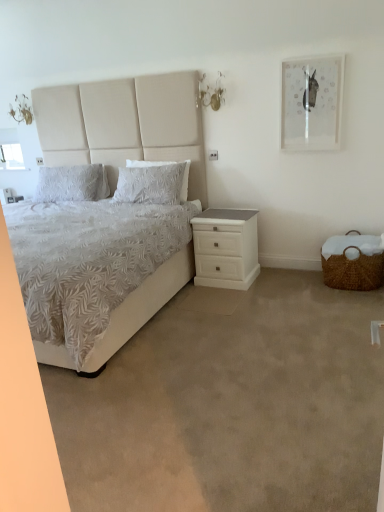
Question: Is white matte nightstand at lower right positioned behind white textured pillow at center, the second pillow when ordered from left to right?

Choices:
 (A) no
 (B) yes

Answer: (A)

Question: Does white matte nightstand at lower right have a lesser height compared to white textured pillow at center, placed as the first pillow when sorted from right to left?

Choices:
 (A) yes
 (B) no

Answer: (B)

Question: Does white matte nightstand at lower right have a smaller size compared to white textured pillow at center, placed as the first pillow when sorted from right to left?

Choices:
 (A) yes
 (B) no

Answer: (B)

Question: Is white textured pillow at center, the second pillow when ordered from left to right, a part of white matte nightstand at lower right?

Choices:
 (A) yes
 (B) no

Answer: (B)

Question: Is white textured pillow at center, placed as the first pillow when sorted from right to left, at the back of white matte nightstand at lower right?

Choices:
 (A) yes
 (B) no

Answer: (B)

Question: From the image's perspective, is white fabric bed at left above or below white textured pillow at center, placed as the first pillow when sorted from right to left?

Choices:
 (A) below
 (B) above

Answer: (A)

Question: Considering the positions of white fabric bed at left and white textured pillow at center, placed as the first pillow when sorted from right to left, in the image, is white fabric bed at left bigger or smaller than white textured pillow at center, placed as the first pillow when sorted from right to left,?

Choices:
 (A) big
 (B) small

Answer: (A)

Question: Is white fabric bed at left in front of or behind white textured pillow at center, the second pillow when ordered from left to right, in the image?

Choices:
 (A) front
 (B) behind

Answer: (A)

Question: Does point (205, 206) appear closer or farther from the camera than point (175, 185)?

Choices:
 (A) farther
 (B) closer

Answer: (A)

Question: Based on their sizes in the image, would you say white textured pillow at center, the second pillow when ordered from left to right, is bigger or smaller than beige carpet at lower center?

Choices:
 (A) big
 (B) small

Answer: (B)

Question: From the image's perspective, is white textured pillow at center, the second pillow when ordered from left to right, located above or below beige carpet at lower center?

Choices:
 (A) below
 (B) above

Answer: (B)

Question: Relative to beige carpet at lower center, is white textured pillow at center, the second pillow when ordered from left to right, in front or behind?

Choices:
 (A) front
 (B) behind

Answer: (B)

Question: Is white textured pillow at center, placed as the first pillow when sorted from right to left, inside the boundaries of beige carpet at lower center, or outside?

Choices:
 (A) outside
 (B) inside

Answer: (A)

Question: From a real-world perspective, is white textured pillow at upper left, the 1th pillow positioned from the left, positioned above or below white fabric bed at left?

Choices:
 (A) below
 (B) above

Answer: (B)

Question: From the image's perspective, is white textured pillow at upper left, which is the second pillow in right-to-left order, positioned above or below white fabric bed at left?

Choices:
 (A) below
 (B) above

Answer: (B)